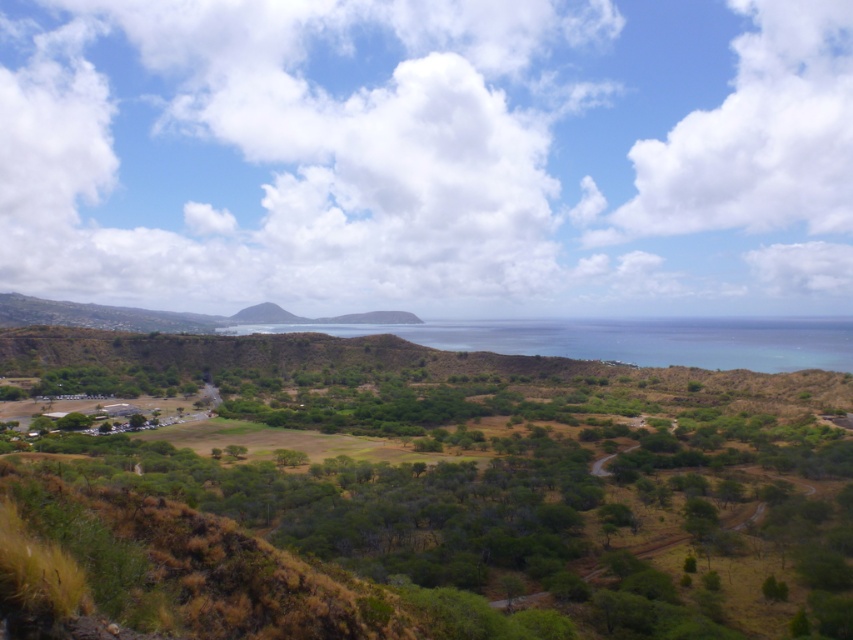
Question: Can you confirm if blue water at center is positioned to the left of green grassy hill at center?

Choices:
 (A) yes
 (B) no

Answer: (B)

Question: Can you confirm if blue water at center is thinner than green grassy hill at center?

Choices:
 (A) no
 (B) yes

Answer: (A)

Question: Does blue water at center appear on the right side of green grassy hill at center?

Choices:
 (A) no
 (B) yes

Answer: (B)

Question: Among these points, which one is farthest from the camera?

Choices:
 (A) (268, 317)
 (B) (606, 339)

Answer: (A)

Question: Which object is closer to the camera taking this photo?

Choices:
 (A) blue water at center
 (B) green grassy hill at center

Answer: (A)